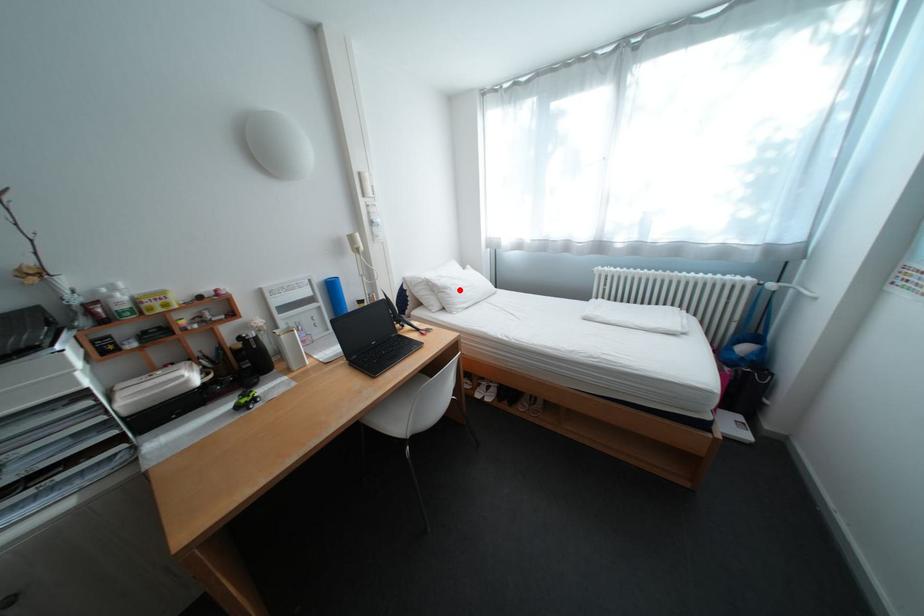
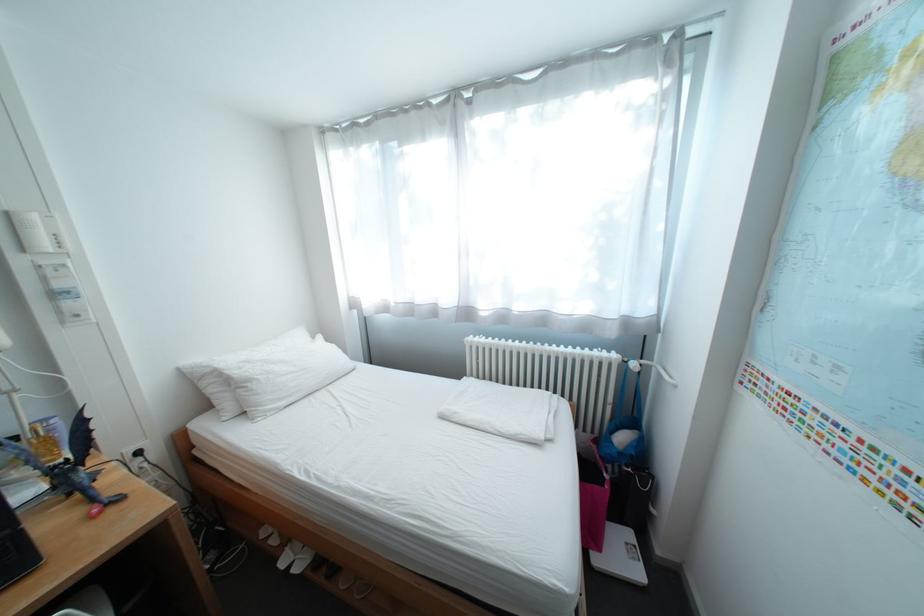
The point at the highlighted location is marked in the first image. Where is the corresponding point in the second image?

(263, 383)